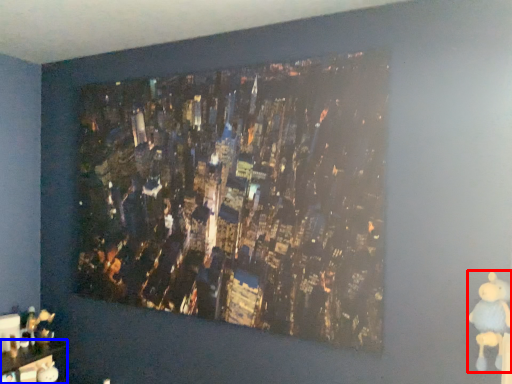
Question: Which object is further to the camera taking this photo, toy (highlighted by a red box) or furniture (highlighted by a blue box)?

Choices:
 (A) toy
 (B) furniture

Answer: (B)